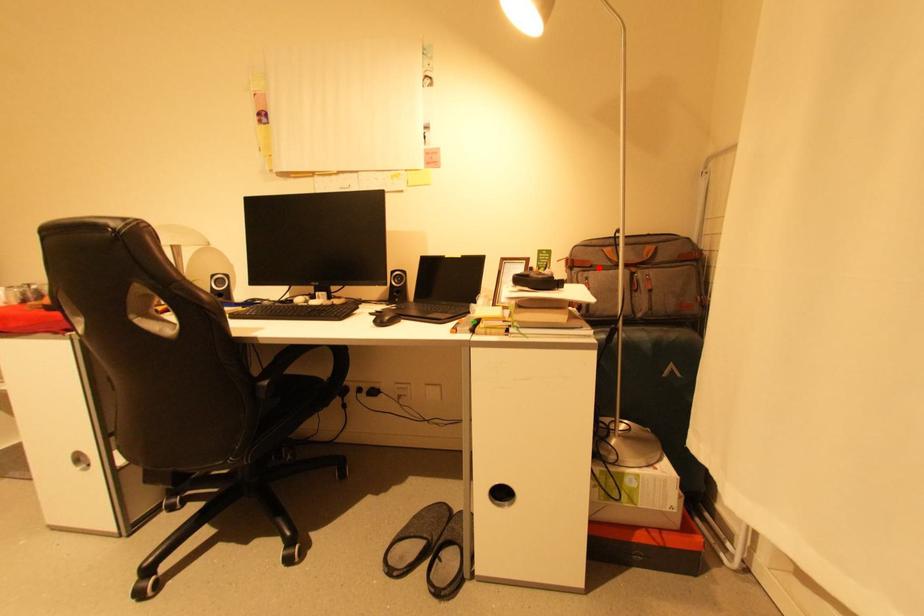
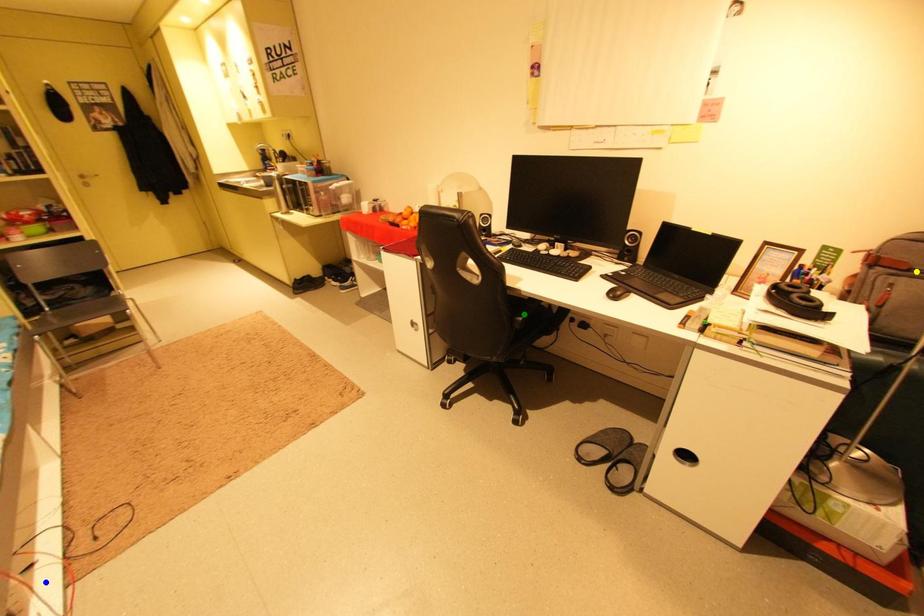
Question: I am providing you with two images of the same scene from different viewpoints. A red point is marked on the first image. You are given multiple points on the second image. Which point in image 2 represents the same 3d spot as the red point in image 1?

Choices:
 (A) yellow point
 (B) blue point
 (C) green point

Answer: (A)